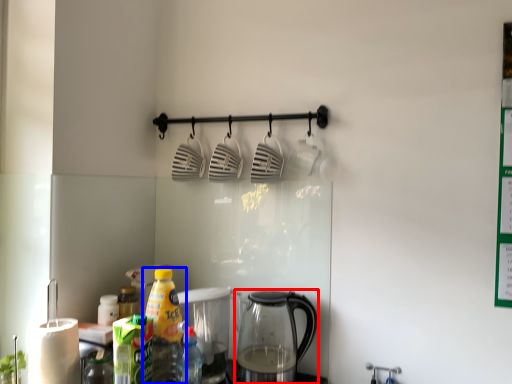
Question: Which object appears closest to the camera in this image, kettle (highlighted by a red box) or bottle (highlighted by a blue box)?

Choices:
 (A) kettle
 (B) bottle

Answer: (B)